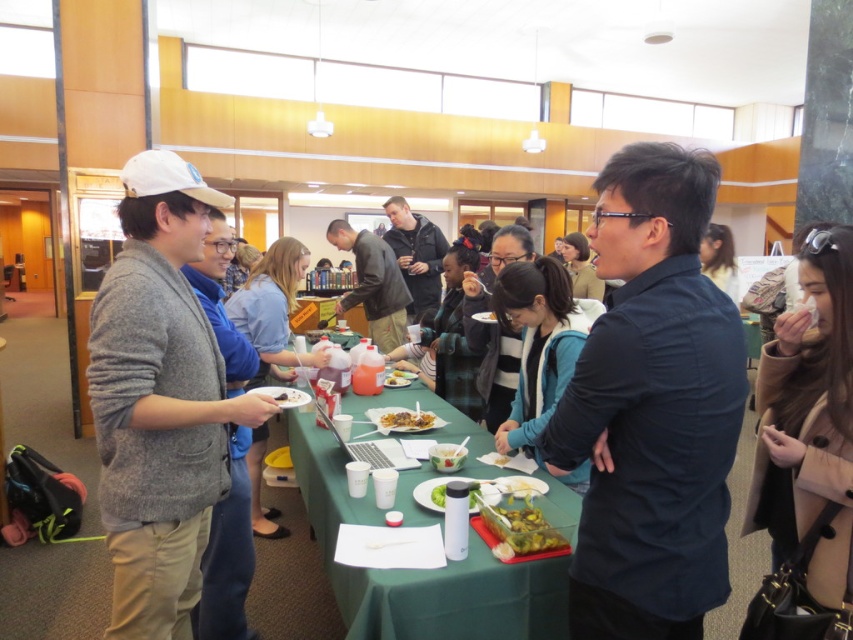
You are a guest at the event and want to place a small gift on the green fabric table at center without it being obstructed by the clear plastic container at center. Is the table high enough to allow this?

The green fabric table at center has a greater height compared to the clear plastic container at center, so yes, the table is high enough to place the small gift without obstruction from the container.

You are setting up a small stand at the event and need to place a 15 cm tall sign on either the green fabric table at center or the yellow matte food at center. Which surface can accommodate the sign without it tipping over, considering their heights?

The green fabric table at center has a greater height compared to the yellow matte food at center, so placing the 15 cm tall sign on the green fabric table at center would be more stable and less likely to tip over due to its higher surface.

You are a guest at this event and want to place a small notebook between the matte gray sweater at center and the white matte bowl at center. Can you fit it there?

The matte gray sweater at center is taller than the white matte bowl at center, so there is vertical space between them. However, since both objects are at the center, their horizontal proximity may limit space for the notebook. Check the horizontal gap before placing it.